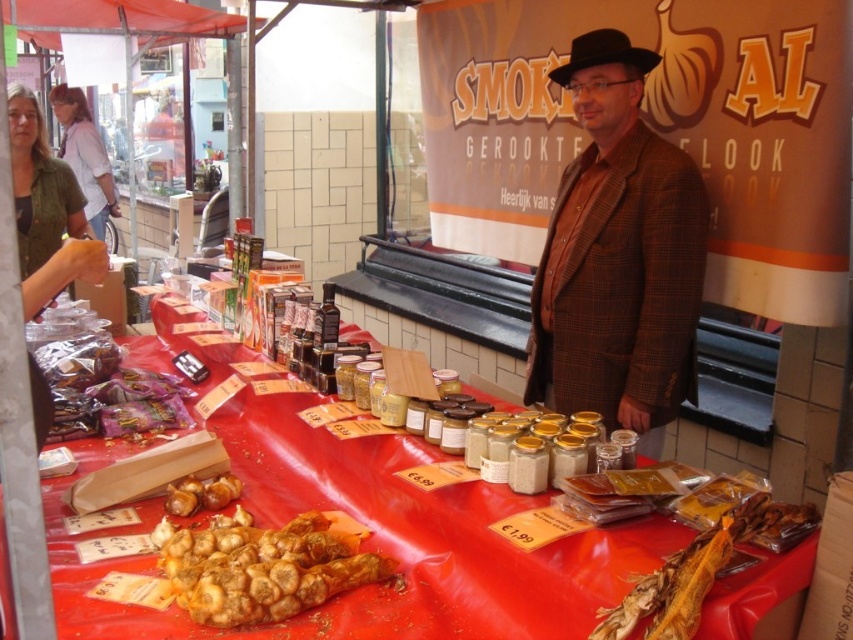
Question: Is brown crispy snack at center wider than green fabric shirt at upper left?

Choices:
 (A) no
 (B) yes

Answer: (B)

Question: Can you confirm if light blue shirt at upper left is positioned to the right of black felt fedora at upper center?

Choices:
 (A) no
 (B) yes

Answer: (A)

Question: Estimate the real-world distances between objects in this image. Which object is farther from the black felt fedora at upper center?

Choices:
 (A) brown crispy snack at center
 (B) brown checkered blazer at center
 (C) brown matte garlic at center
 (D) light blue shirt at upper left

Answer: (D)

Question: Is brown checkered blazer at center positioned at the back of light blue shirt at upper left?

Choices:
 (A) no
 (B) yes

Answer: (A)

Question: Which point appears closest to the camera in this image?

Choices:
 (A) (41, 129)
 (B) (624, 284)

Answer: (B)

Question: Which point appears closest to the camera in this image?

Choices:
 (A) (595, 276)
 (B) (556, 74)
 (C) (172, 500)

Answer: (C)